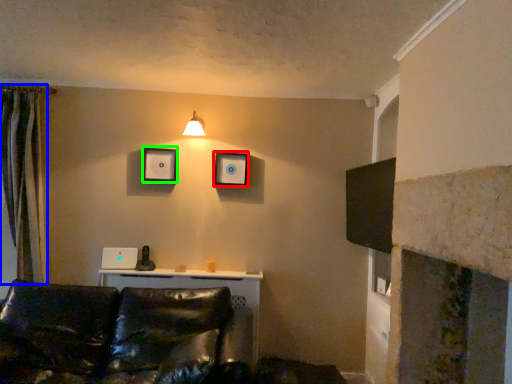
Question: Estimate the real-world distances between objects in this image. Which object is farther from picture frame (highlighted by a red box), curtain (highlighted by a blue box) or picture frame (highlighted by a green box)?

Choices:
 (A) curtain
 (B) picture frame

Answer: (A)